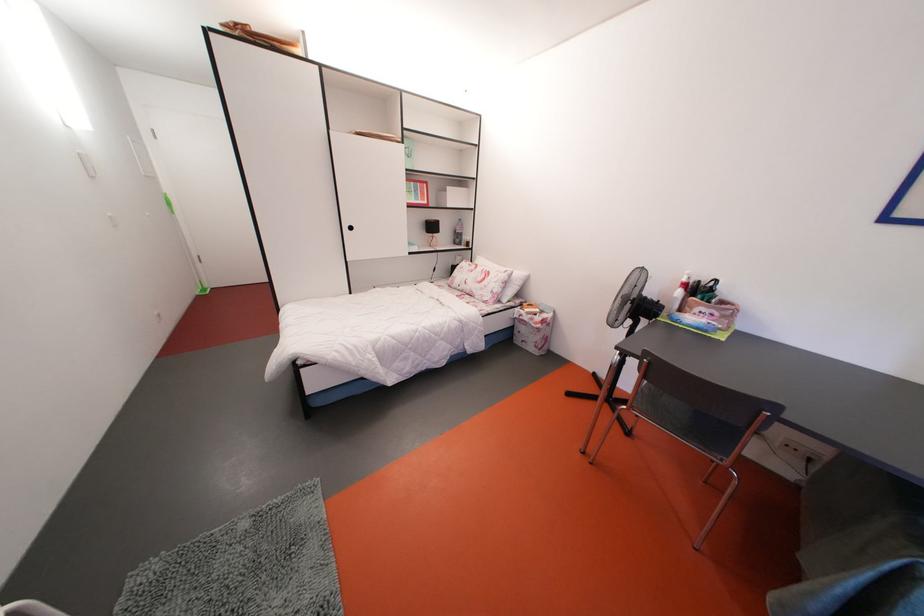
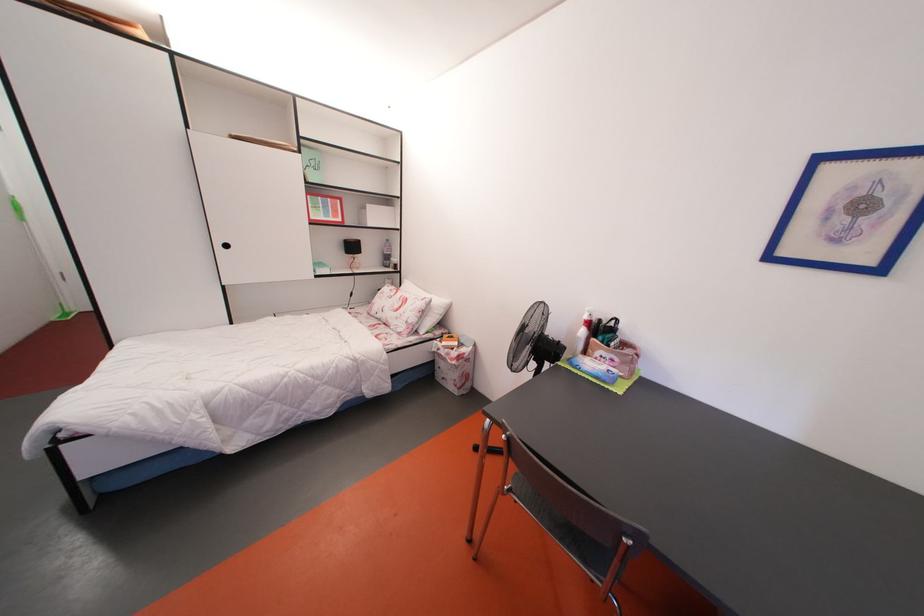
The images are taken continuously from a first-person perspective. In which direction are you moving?

The cameraman moved toward right, forward.